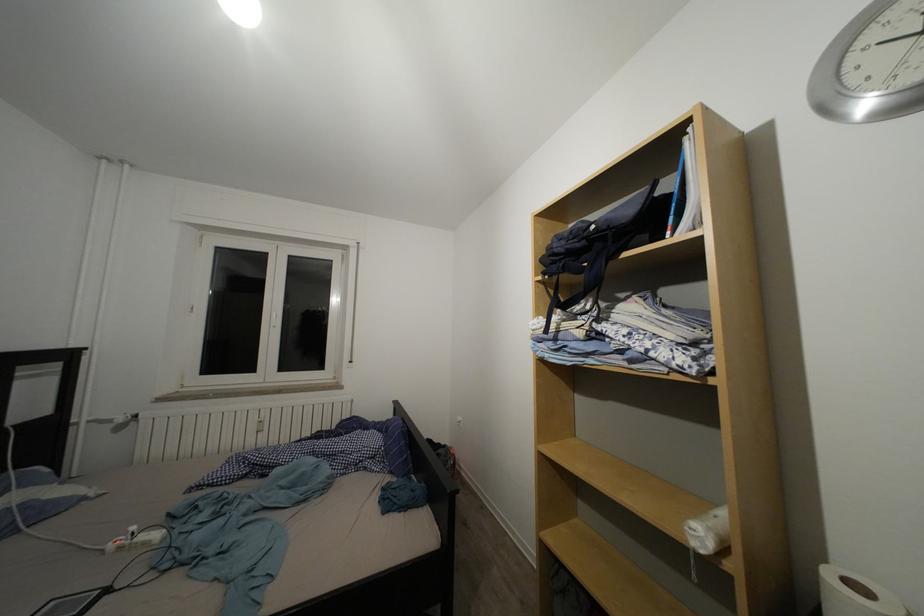
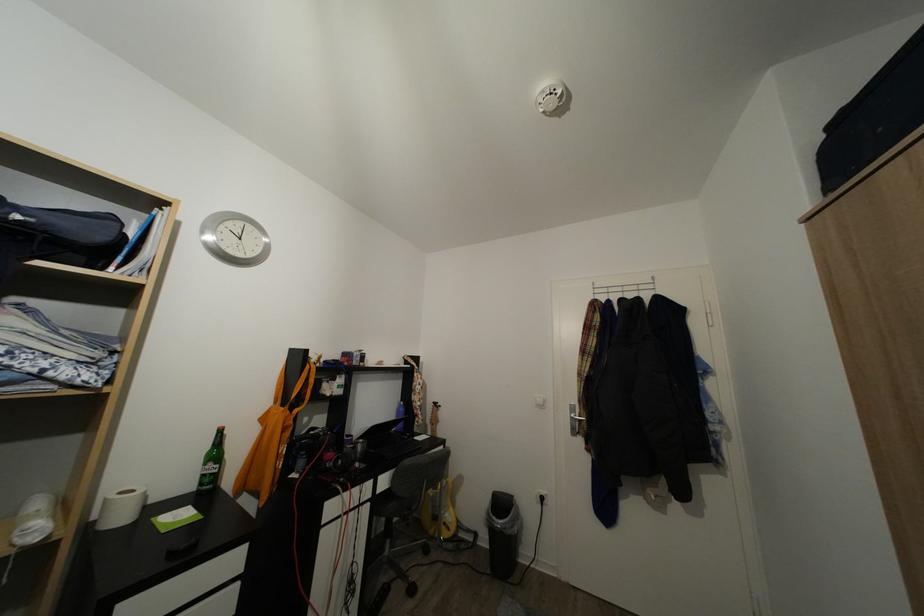
The point at (601, 233) is marked in the first image. Where is the corresponding point in the second image?

(25, 223)